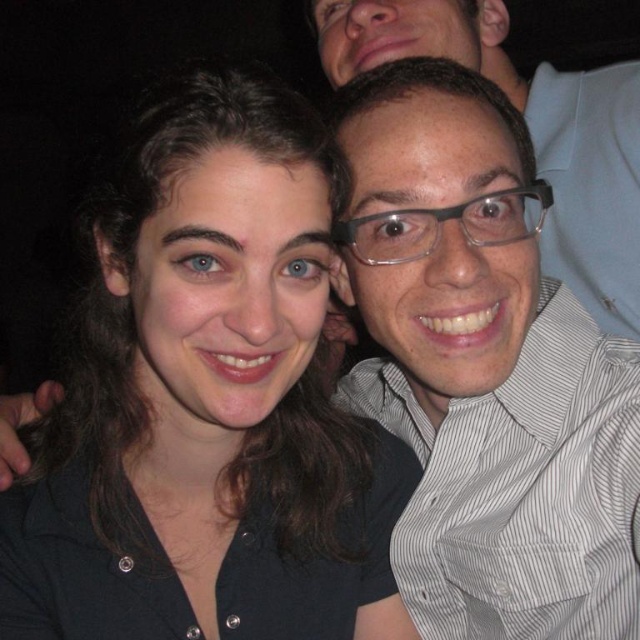
Question: Which object is the farthest from the clear plastic glasses at upper right?

Choices:
 (A) black matte shirt at center
 (B) white striped shirt at center

Answer: (A)

Question: Is black matte shirt at center closer to the viewer compared to white striped shirt at center?

Choices:
 (A) yes
 (B) no

Answer: (A)

Question: Which point is farther to the camera?

Choices:
 (A) white striped shirt at center
 (B) clear plastic glasses at upper right

Answer: (B)

Question: Which point is closer to the camera taking this photo?

Choices:
 (A) (317, 244)
 (B) (620, 620)

Answer: (A)

Question: Does white striped shirt at center appear under clear plastic glasses at upper right?

Choices:
 (A) no
 (B) yes

Answer: (B)

Question: Can you confirm if white striped shirt at center is smaller than clear plastic glasses at upper right?

Choices:
 (A) yes
 (B) no

Answer: (A)